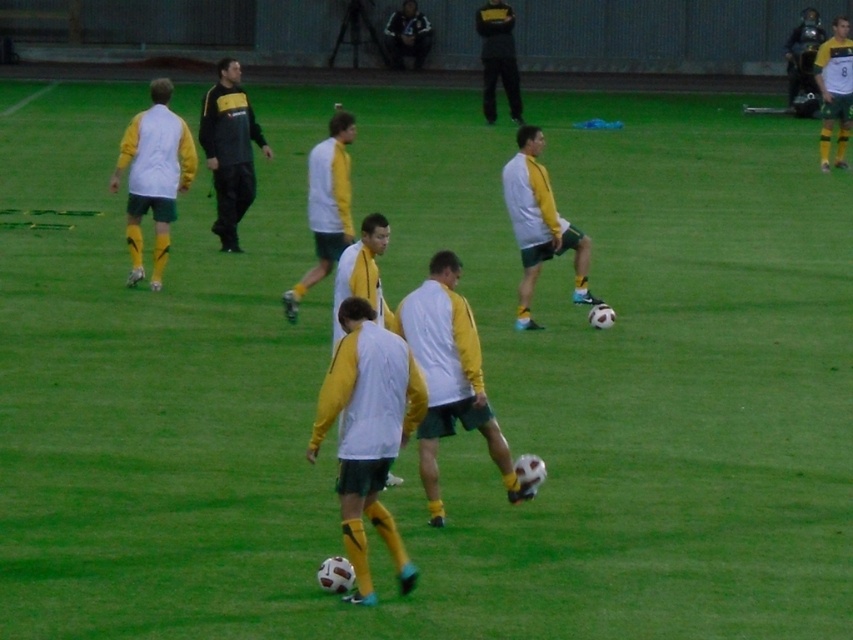
Question: Can you confirm if white matte jersey at center is positioned to the left of white/yellow jersey at center?

Choices:
 (A) no
 (B) yes

Answer: (A)

Question: Considering the real-world distances, which object is closest to the white/yellow jersey at center?

Choices:
 (A) white/yellow jersey at left
 (B) white matte vest at center

Answer: (A)

Question: Among these points, which one is nearest to the camera?

Choices:
 (A) (224, 244)
 (B) (338, 470)
 (C) (786, 61)
 (D) (509, 29)

Answer: (B)

Question: Considering the real-world distances, which object is closest to the shiny black helmet at upper right?

Choices:
 (A) black matte jacket at center
 (B) white/yellow jersey at left
 (C) white/yellow jersey at center
 (D) yellow matte jacket at center

Answer: (A)

Question: Can you confirm if yellow matte jersey at upper right is positioned to the left of black matte jacket at upper center?

Choices:
 (A) yes
 (B) no

Answer: (B)

Question: Does yellow matte jacket at center appear over yellow matte jersey at upper right?

Choices:
 (A) no
 (B) yes

Answer: (A)